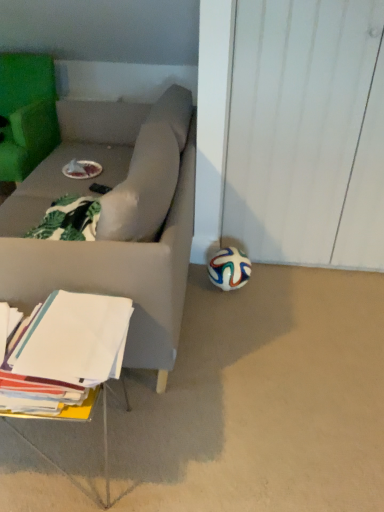
Question: Does multicolored rubber ball at lower right have a greater width compared to white paper at lower left?

Choices:
 (A) no
 (B) yes

Answer: (A)

Question: Can you confirm if multicolored rubber ball at lower right is positioned to the left of white paper at lower left?

Choices:
 (A) yes
 (B) no

Answer: (B)

Question: Is the position of multicolored rubber ball at lower right more distant than that of white paper at lower left?

Choices:
 (A) yes
 (B) no

Answer: (A)

Question: Considering the relative sizes of multicolored rubber ball at lower right and white paper at lower left in the image provided, is multicolored rubber ball at lower right thinner than white paper at lower left?

Choices:
 (A) yes
 (B) no

Answer: (A)

Question: Is multicolored rubber ball at lower right positioned before white paper at lower left?

Choices:
 (A) no
 (B) yes

Answer: (A)

Question: From a real-world perspective, is multicolored rubber ball at lower right above or below white paper at lower left?

Choices:
 (A) below
 (B) above

Answer: (A)

Question: Based on their sizes in the image, would you say multicolored rubber ball at lower right is bigger or smaller than white paper at lower left?

Choices:
 (A) small
 (B) big

Answer: (A)

Question: Based on their positions, is multicolored rubber ball at lower right located to the left or right of white paper at lower left?

Choices:
 (A) right
 (B) left

Answer: (A)

Question: Considering the positions of multicolored rubber ball at lower right and white paper at lower left in the image, is multicolored rubber ball at lower right taller or shorter than white paper at lower left?

Choices:
 (A) tall
 (B) short

Answer: (B)

Question: From a real-world perspective, is white matte soccer ball at lower right positioned above or below white paper at lower left?

Choices:
 (A) above
 (B) below

Answer: (B)

Question: Is point (332, 334) positioned closer to the camera than point (34, 349)?

Choices:
 (A) farther
 (B) closer

Answer: (A)

Question: From their relative heights in the image, would you say white matte soccer ball at lower right is taller or shorter than white paper at lower left?

Choices:
 (A) short
 (B) tall

Answer: (A)

Question: Based on their positions, is white matte soccer ball at lower right located to the left or right of white paper at lower left?

Choices:
 (A) right
 (B) left

Answer: (A)

Question: Is point (9, 389) positioned closer to the camera than point (233, 286)?

Choices:
 (A) closer
 (B) farther

Answer: (A)

Question: From a real-world perspective, relative to multicolored rubber ball at lower right, is white paper at lower left vertically above or below?

Choices:
 (A) above
 (B) below

Answer: (A)